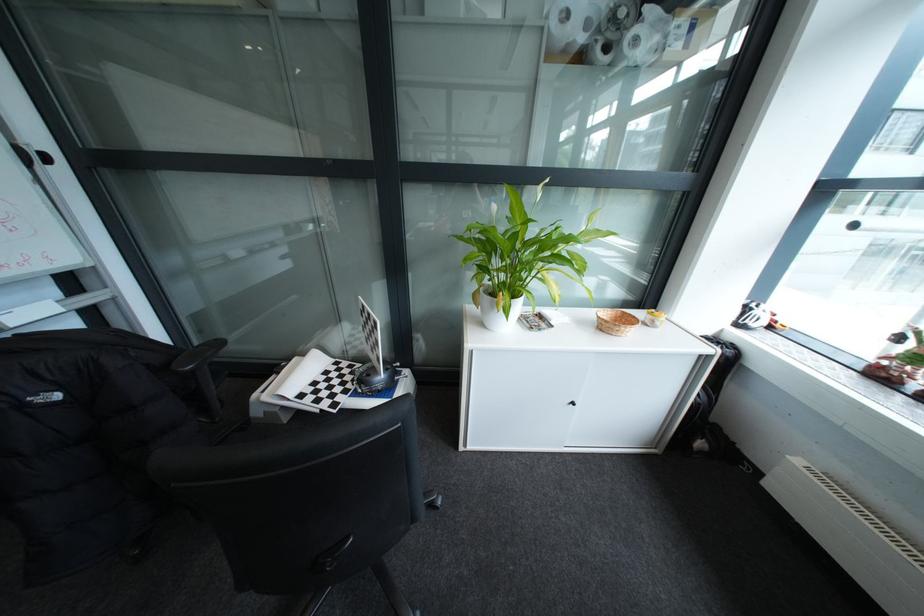
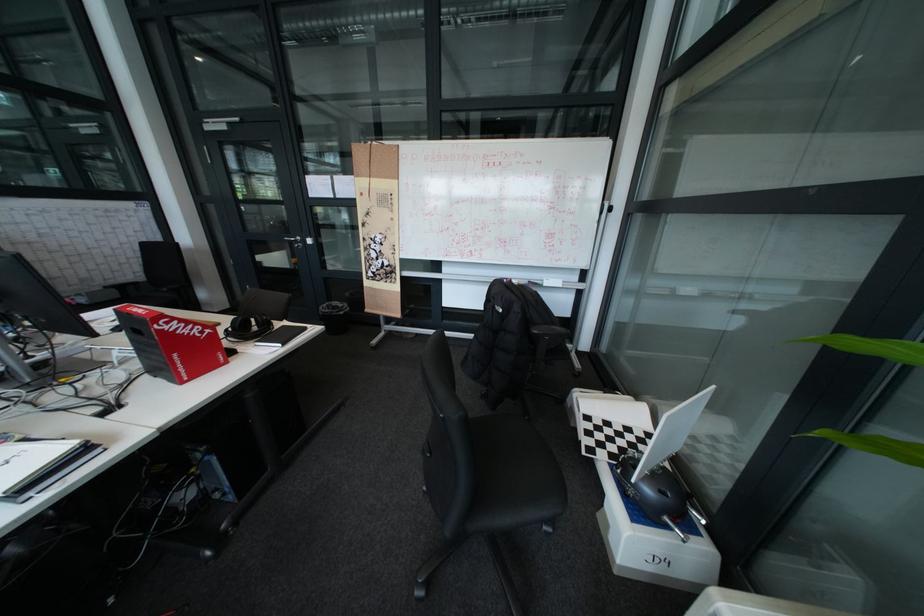
Locate, in the second image, the point that corresponds to (346,365) in the first image.

(659, 432)